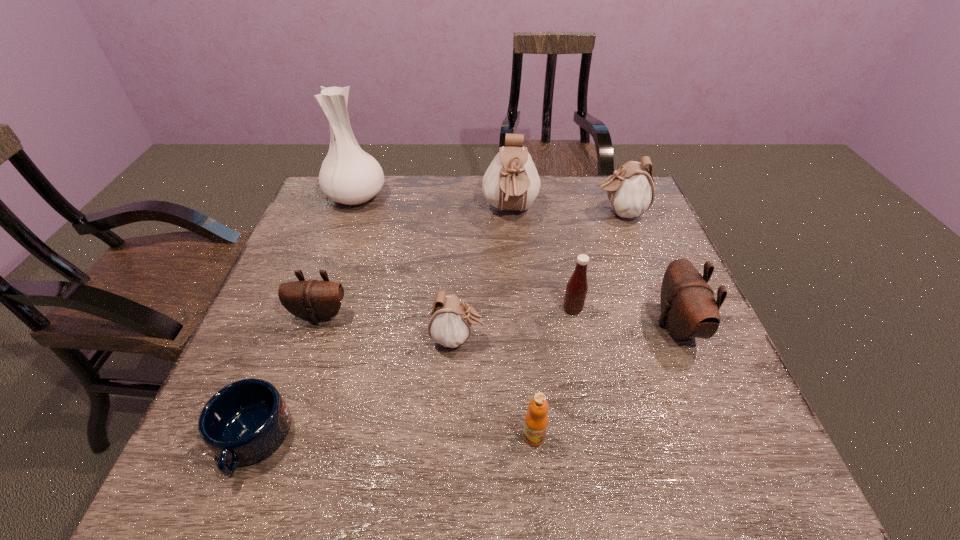
Select which white pouch is the third closest to the leftmost pouch. Please provide its 2D coordinates. Your answer should be formatted as a tuple, i.e. [(x, y)], where the tuple contains the x and y coordinates of a point satisfying the conditions above.

[(630, 190)]

Select which white pouch appears as the second closest to the rightmost white pouch. Please provide its 2D coordinates. Your answer should be formatted as a tuple, i.e. [(x, y)], where the tuple contains the x and y coordinates of a point satisfying the conditions above.

[(450, 320)]

This screenshot has width=960, height=540. I want to click on vacant space that satisfies the following two spatial constraints: 1. with the flap open on the bigger brown pouch; 2. with the handle on the side of the blue mug, so click(x=724, y=439).

Find the location of `free spot that satisfies the following two spatial constraints: 1. on the front-facing side of the second biggest white pouch; 2. on the front label of the orange juice`. free spot that satisfies the following two spatial constraints: 1. on the front-facing side of the second biggest white pouch; 2. on the front label of the orange juice is located at coordinates (705, 436).

What are the coordinates of `vacant area that satisfies the following two spatial constraints: 1. on the front-facing side of the second biggest white pouch; 2. with the handle on the side of the blue mug` in the screenshot? It's located at (707, 439).